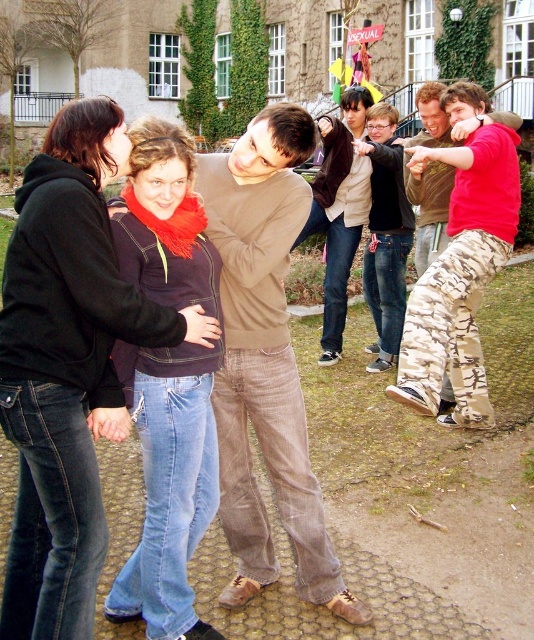
Question: Which point is closer to the camera?

Choices:
 (A) camouflage pants at right
 (B) camouflage pants at center
 (C) brown corduroy pants at center

Answer: (C)

Question: Among these objects, which one is farthest from the camera?

Choices:
 (A) brown corduroy pants at center
 (B) camouflage pants at center
 (C) camouflage pants at right
 (D) brown suede jacket at center

Answer: (D)

Question: Which object is the closest to the camouflage pants at right?

Choices:
 (A) denim jeans at left
 (B) brown corduroy pants at center
 (C) brown suede jacket at center

Answer: (B)

Question: Can you confirm if camouflage pants at right is positioned above camouflage pants at center?

Choices:
 (A) no
 (B) yes

Answer: (A)

Question: Is denim jeans at left positioned behind camouflage pants at right?

Choices:
 (A) no
 (B) yes

Answer: (A)

Question: Observing the image, what is the correct spatial positioning of denim jeans at left in reference to camouflage pants at right?

Choices:
 (A) above
 (B) below

Answer: (B)